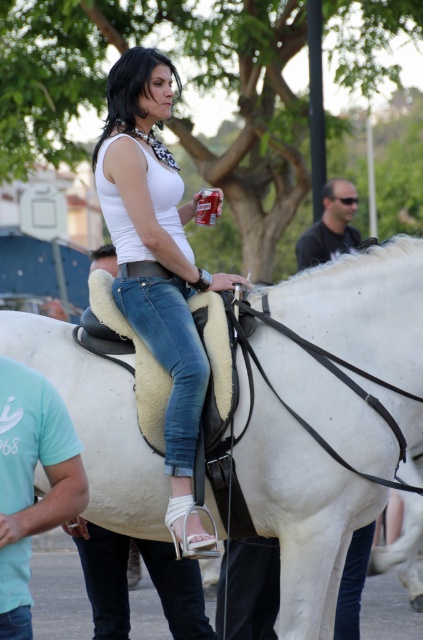
You are a photographer trying to capture a clear shot of the white leather saddle at upper center and the matte black shirt at upper right. Since both are in the same frame, which object is closer to the camera?

The white leather saddle at upper center is closer to the camera because it is in front of the matte black shirt at upper right.

You are standing in the scene and want to pick up an object located at point (x=35, y=477). The object is 9.11 meters away from you. If your maximum reach is 5 meters, can you reach it without moving?

The point at (x=35, y=477) is 9.11 meters away from you. Since your maximum reach is 5 meters, you cannot reach it without moving closer.